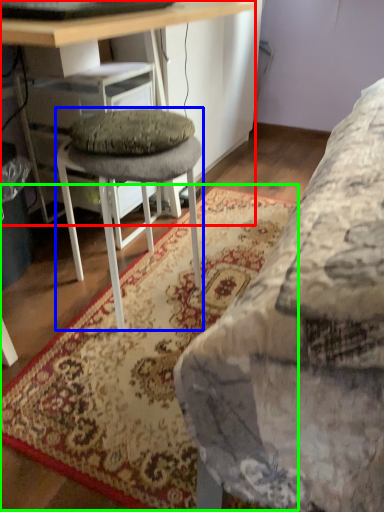
Question: Estimate the real-world distances between objects in this image. Which object is farther from desk (highlighted by a red box), stool (highlighted by a blue box) or mat (highlighted by a green box)?

Choices:
 (A) stool
 (B) mat

Answer: (B)